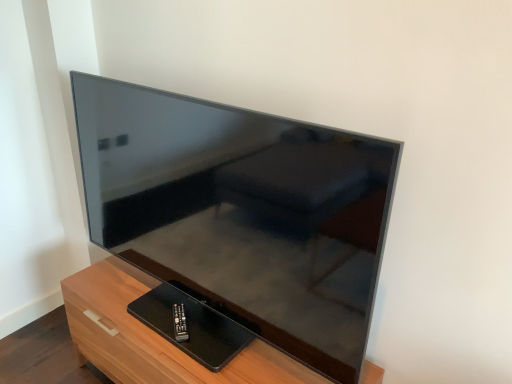
The image size is (512, 384). I want to click on free point to the right of black plastic remote at lower center, so click(215, 340).